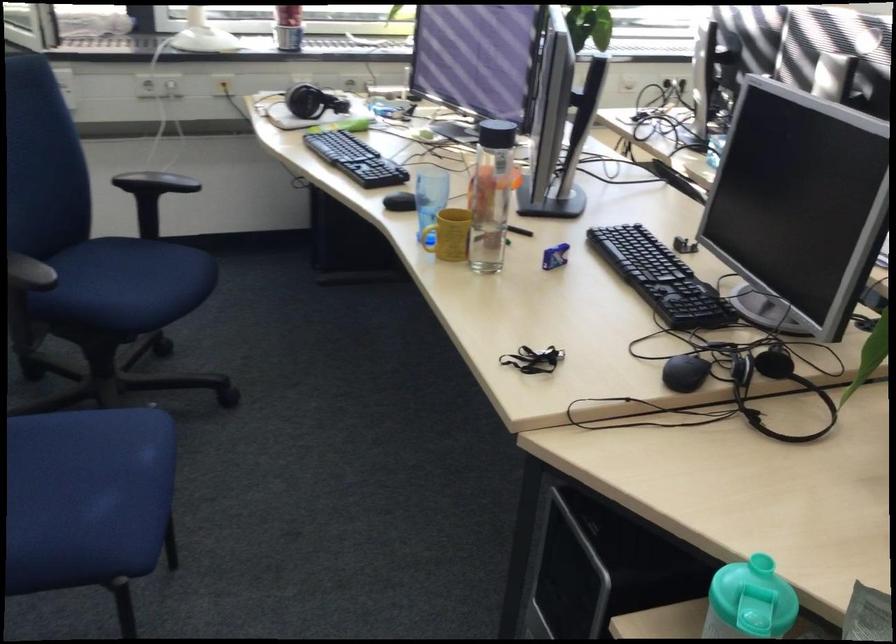
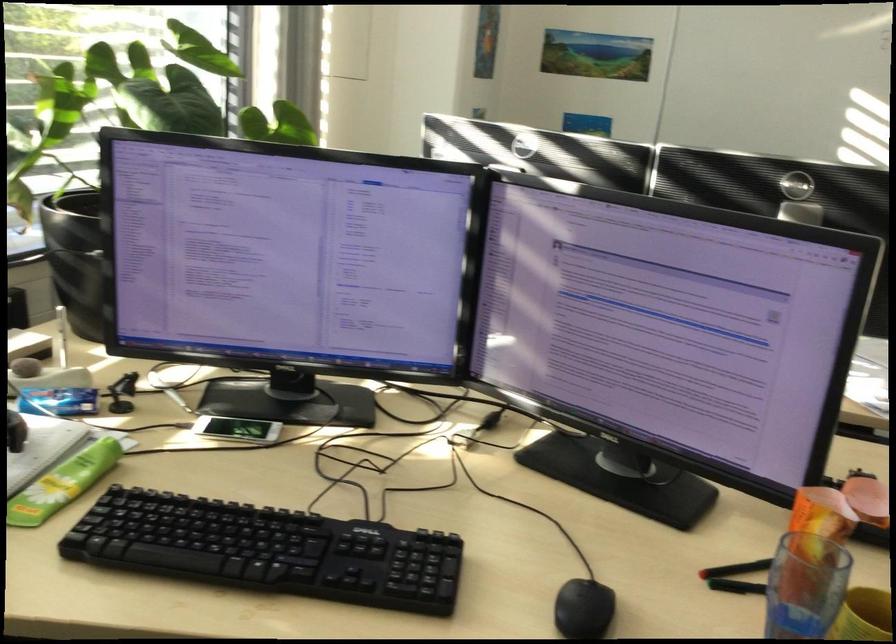
The point at (382, 169) is marked in the first image. Where is the corresponding point in the second image?

(424, 565)